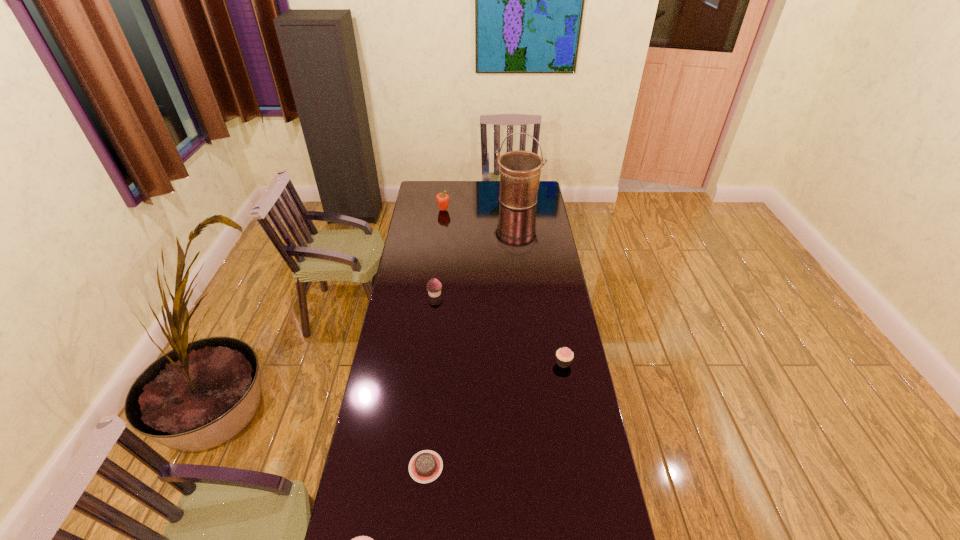
Select which cupcake is the closest to the farthest cupcake. Please provide its 2D coordinates. Your answer should be formatted as a tuple, i.e. [(x, y)], where the tuple contains the x and y coordinates of a point satisfying the conditions above.

[(564, 356)]

Where is `vacant space that satisfies the following two spatial constraints: 1. on the back side of the second cupcake from left to right; 2. on the right side of the bucket`? This screenshot has height=540, width=960. vacant space that satisfies the following two spatial constraints: 1. on the back side of the second cupcake from left to right; 2. on the right side of the bucket is located at coordinates (445, 200).

Find the location of a particular element. Image resolution: width=960 pixels, height=540 pixels. vacant space that satisfies the following two spatial constraints: 1. on the back side of the tallest object; 2. on the right side of the pepper is located at coordinates (444, 200).

The height and width of the screenshot is (540, 960). I want to click on free space that satisfies the following two spatial constraints: 1. on the front side of the fourth nearest object; 2. on the left side of the second farthest cupcake, so click(427, 363).

Locate an element on the screen. free spot that satisfies the following two spatial constraints: 1. on the front side of the bucket; 2. on the right side of the rightmost cupcake is located at coordinates (539, 363).